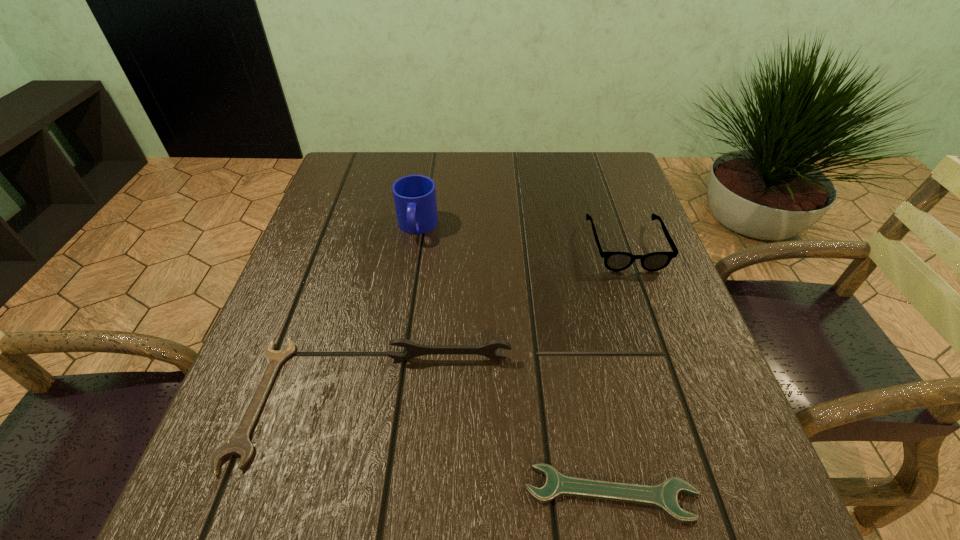
This screenshot has width=960, height=540. Find the location of `object located at the left edge`. object located at the left edge is located at coordinates (239, 443).

Image resolution: width=960 pixels, height=540 pixels. I want to click on spectacles that is at the right edge, so click(614, 261).

You are a GUI agent. You are given a task and a screenshot of the screen. Output one action in this format:
    pyautogui.click(x=<x>, y=<y>)
    Task: Click on the wrench that is at the right edge
    
    Given the screenshot: What is the action you would take?
    pyautogui.click(x=663, y=496)

You are a GUI agent. You are given a task and a screenshot of the screen. Output one action in this format:
    pyautogui.click(x=<x>, y=<y>)
    Task: Click on the object positioned at the near left corner
    Image resolution: width=960 pixels, height=540 pixels.
    Given the screenshot: What is the action you would take?
    pyautogui.click(x=239, y=443)

The width and height of the screenshot is (960, 540). Find the location of `object located in the near right corner section of the desktop`. object located in the near right corner section of the desktop is located at coordinates (663, 496).

Image resolution: width=960 pixels, height=540 pixels. Find the location of `vacant space at the far edge of the desktop`. vacant space at the far edge of the desktop is located at coordinates (511, 160).

This screenshot has height=540, width=960. I want to click on vacant space at the near edge, so click(x=397, y=496).

Where is `vacant area at the left edge of the desktop`? Image resolution: width=960 pixels, height=540 pixels. vacant area at the left edge of the desktop is located at coordinates (314, 263).

The width and height of the screenshot is (960, 540). Find the location of `vacant area at the right edge`. vacant area at the right edge is located at coordinates (672, 382).

Image resolution: width=960 pixels, height=540 pixels. I want to click on vacant area at the far left corner, so click(393, 160).